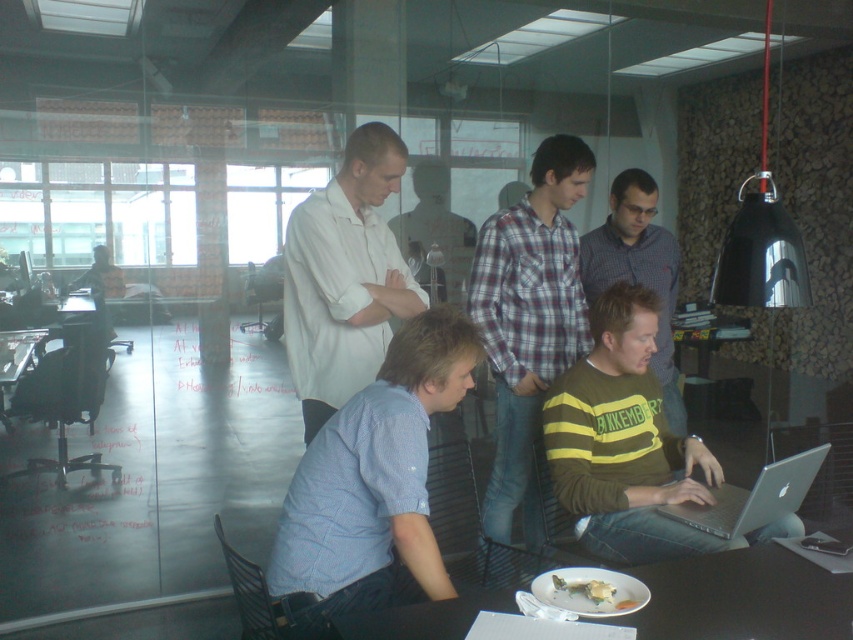
You are organizing a small event and need to place a decorative item on the table. The plaid cotton shirt at center and the black plastic table at lower left are available. Which object can you place on the table without taking up too much space?

The black plastic table at lower left is smaller in size, so it can be placed on the table without taking up too much space.

You are standing in the office and want to pick up an item from the table. Which of the two points, point (766,628) or point (602,289), is closer to you?

Point (766,628) is closer to the viewer than point (602,289), so you should pick up the item from point (766,628) first as it is nearer to you.